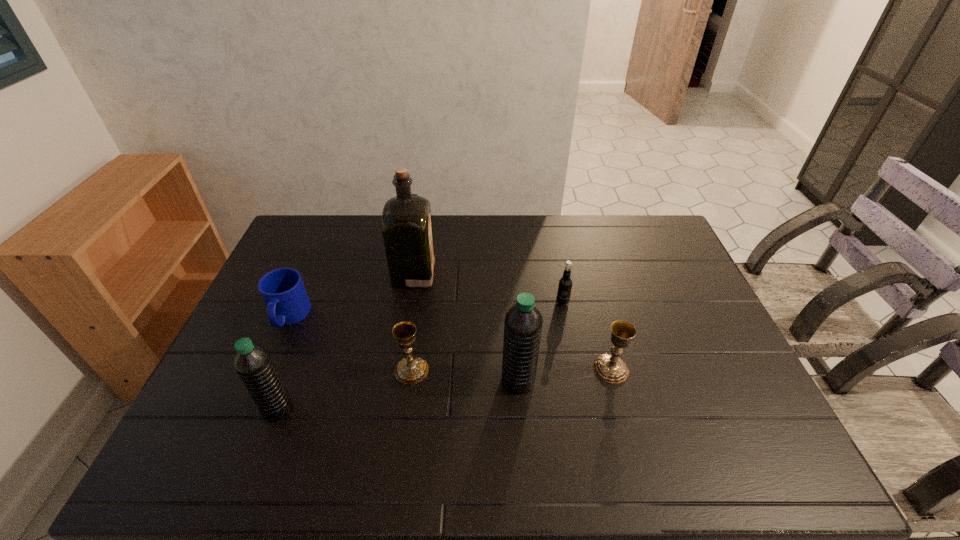
Identify the location of free space located on the right of the left water bottle. (442, 409).

Locate an element on the screen. The height and width of the screenshot is (540, 960). vacant position located on the right of the right water bottle is located at coordinates (558, 380).

Find the location of a particular element. The width and height of the screenshot is (960, 540). vacant space located 0.050m on the label of the root beer is located at coordinates (565, 320).

The width and height of the screenshot is (960, 540). Find the location of `free spot located on the label of the farthest object`. free spot located on the label of the farthest object is located at coordinates (462, 273).

Locate an element on the screen. This screenshot has width=960, height=540. vacant region located on the side with the handle of the mug is located at coordinates (274, 352).

The width and height of the screenshot is (960, 540). Identify the location of vacant space situated 0.140m on the back of the left chalice. (419, 320).

Image resolution: width=960 pixels, height=540 pixels. In order to click on free region located on the back of the rightmost object in this screenshot , I will do `click(593, 303)`.

Image resolution: width=960 pixels, height=540 pixels. In order to click on object that is positioned at the near edge in this screenshot , I will do `click(254, 365)`.

At what (x,y) coordinates should I click in order to perform the action: click on water bottle that is at the left edge. Please return your answer as a coordinate pair (x, y). The width and height of the screenshot is (960, 540). Looking at the image, I should click on (254, 365).

You are a GUI agent. You are given a task and a screenshot of the screen. Output one action in this format:
    pyautogui.click(x=<x>, y=<y>)
    Task: Click on the mug located in the left edge section of the desktop
    The height and width of the screenshot is (540, 960).
    Given the screenshot: What is the action you would take?
    pyautogui.click(x=283, y=292)